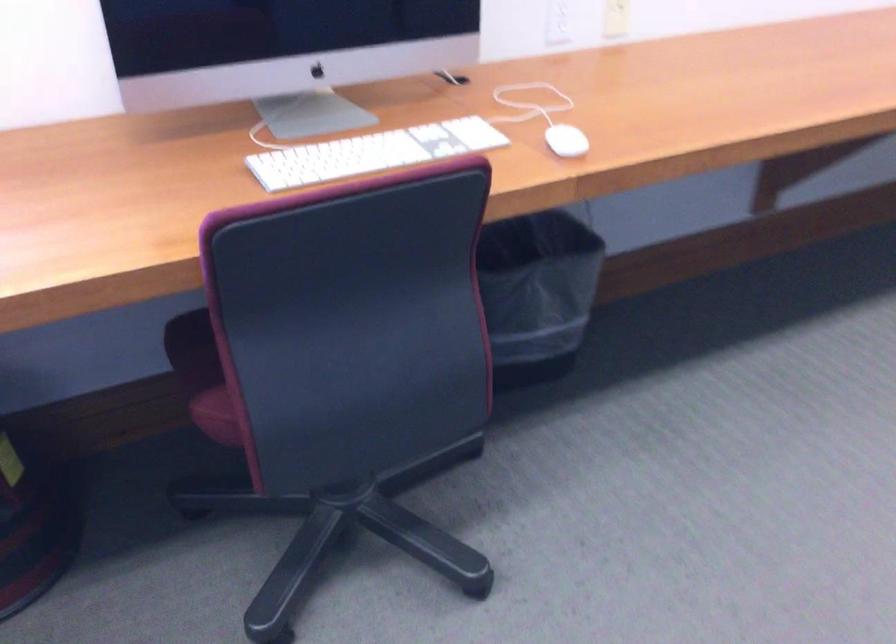
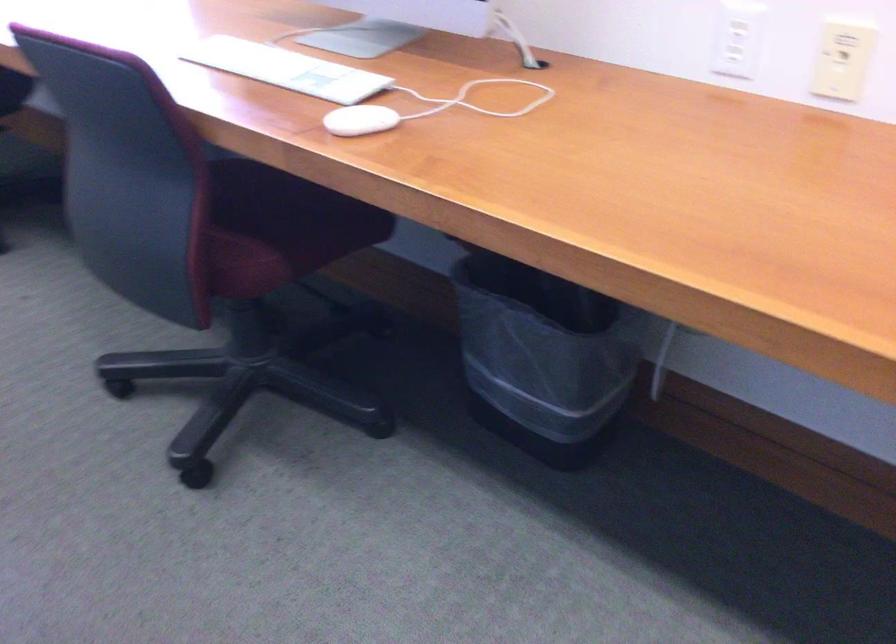
Find the pixel in the second image that matches point 581,281 in the first image.

(543, 357)